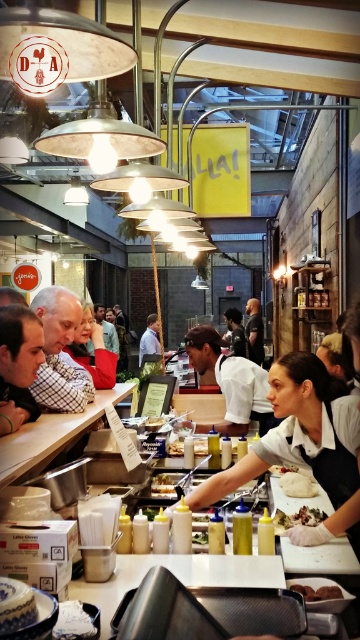
Is dark brown leather jacket at center closer to camera compared to shiny golden bread at center?

No.

Which is more to the right, dark brown leather jacket at center or shiny golden bread at center?

Positioned to the right is dark brown leather jacket at center.

Who is more forward, [243,349] or [299,508]?

Positioned in front is point [299,508].

The width and height of the screenshot is (360, 640). I want to click on dark brown leather jacket at center, so click(236, 332).

How distant is red fleece jacket at center from brown matte chocolate at center?

red fleece jacket at center is 1.98 meters away from brown matte chocolate at center.

Who is taller, red fleece jacket at center or brown matte chocolate at center?

red fleece jacket at center

Is point (79, 360) closer to viewer compared to point (303, 593)?

No, it is behind (303, 593).

In order to click on red fleece jacket at center in this screenshot , I will do `click(93, 349)`.

Can you confirm if white glossy table at lower left is smaller than red fleece jacket at center?

Yes.

Between white glossy table at lower left and red fleece jacket at center, which one is positioned higher?

Positioned higher is red fleece jacket at center.

This screenshot has width=360, height=640. What do you see at coordinates (51, 435) in the screenshot?
I see `white glossy table at lower left` at bounding box center [51, 435].

I want to click on white glossy table at lower left, so click(51, 435).